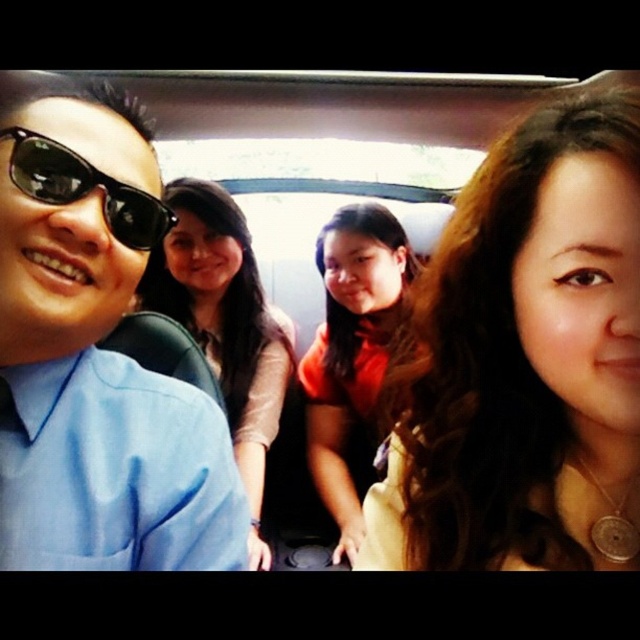
You are a passenger in the vehicle and want to hand a document to the person wearing the orange matte shirt at center without disturbing the person with black matte sunglasses at left. How should you adjust your approach?

The orange matte shirt at center is positioned under the black matte sunglasses at left, so you should approach from below the black matte sunglasses at left to reach the orange matte shirt at center without disturbing them.

You are a photographer trying to adjust the lighting in the van. You need to know if the matte blue shirt at left is closer to the camera than the matte brown hair at center. Can you determine this based on their heights in the photo?

The matte blue shirt at left is shorter than the matte brown hair at center in the photo, which suggests that the matte blue shirt at left is farther from the camera compared to the matte brown hair at center. Therefore, the matte blue shirt at left is not closer to the camera than the matte brown hair at center.

You are a photographer trying to adjust the lighting for a group photo in the van. You notice the matte blue shirt at left and the matte brown hair at center. Which object is positioned higher in the frame?

The matte blue shirt at left is located above the matte brown hair at center, so it is positioned higher in the frame.